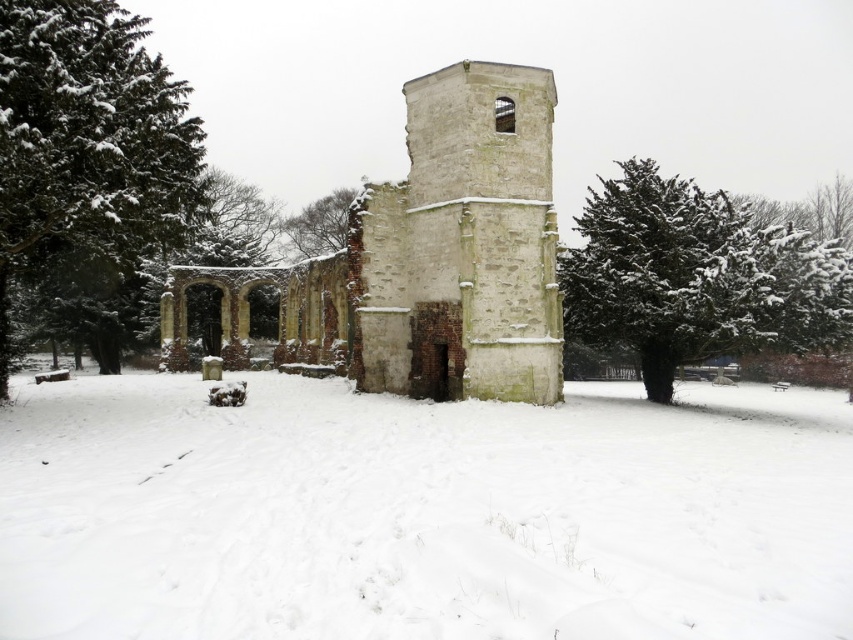
Question: Is stone church at center in front of green textured pine tree at left?

Choices:
 (A) no
 (B) yes

Answer: (A)

Question: Does white fluffy snow at center appear on the right side of stone church at center?

Choices:
 (A) no
 (B) yes

Answer: (B)

Question: Among these objects, which one is farthest from the camera?

Choices:
 (A) white fluffy snow at center
 (B) snow-covered evergreen at center
 (C) green textured pine tree at left
 (D) snow-covered branches at center

Answer: (D)

Question: Which point is closer to the camera?

Choices:
 (A) green textured pine tree at left
 (B) stone church at center

Answer: (A)

Question: Is stone church at center positioned behind green textured pine tree at left?

Choices:
 (A) no
 (B) yes

Answer: (B)

Question: Estimate the real-world distances between objects in this image. Which object is closer to the green textured pine tree at left?

Choices:
 (A) snow-covered branches at center
 (B) stone church at center

Answer: (B)